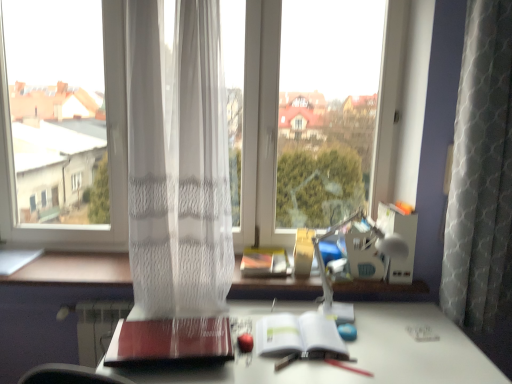
Question: Is white glossy desk at center next to white sheer curtain at center and touching it?

Choices:
 (A) no
 (B) yes

Answer: (A)

Question: Is white glossy desk at center positioned with its back to white sheer curtain at center?

Choices:
 (A) yes
 (B) no

Answer: (B)

Question: Is white glossy desk at center to the left of white sheer curtain at center from the viewer's perspective?

Choices:
 (A) yes
 (B) no

Answer: (B)

Question: Is white sheer curtain at center completely or partially inside white glossy desk at center?

Choices:
 (A) yes
 (B) no

Answer: (B)

Question: Does white glossy desk at center have a lesser width compared to white sheer curtain at center?

Choices:
 (A) yes
 (B) no

Answer: (B)

Question: In terms of size, does matte red notebook at center, the 1th paperback book viewed from the left, appear bigger or smaller than white sheer curtain at center?

Choices:
 (A) small
 (B) big

Answer: (A)

Question: Looking at their shapes, would you say matte red notebook at center, positioned as the second paperback book in right-to-left order, is wider or thinner than white sheer curtain at center?

Choices:
 (A) wide
 (B) thin

Answer: (A)

Question: Would you say matte red notebook at center, the 1th paperback book viewed from the left, is inside or outside white sheer curtain at center?

Choices:
 (A) outside
 (B) inside

Answer: (A)

Question: Considering the positions of matte red notebook at center, positioned as the second paperback book in right-to-left order, and white sheer curtain at center in the image, is matte red notebook at center, positioned as the second paperback book in right-to-left order, taller or shorter than white sheer curtain at center?

Choices:
 (A) short
 (B) tall

Answer: (A)

Question: From the image's perspective, is transparent fabric at center located above or below matte red notebook at center, positioned as the second paperback book in right-to-left order?

Choices:
 (A) above
 (B) below

Answer: (A)

Question: Choose the correct answer: Is transparent fabric at center inside matte red notebook at center, the 1th paperback book viewed from the left, or outside it?

Choices:
 (A) inside
 (B) outside

Answer: (B)

Question: Is point (121, 185) closer or farther from the camera than point (194, 357)?

Choices:
 (A) farther
 (B) closer

Answer: (A)

Question: Is transparent fabric at center to the left or to the right of matte red notebook at center, the 1th paperback book viewed from the left, in the image?

Choices:
 (A) left
 (B) right

Answer: (A)

Question: Looking at the image, does white sheer curtain at center seem bigger or smaller compared to transparent fabric at center?

Choices:
 (A) small
 (B) big

Answer: (A)

Question: From a real-world perspective, is white sheer curtain at center above or below transparent fabric at center?

Choices:
 (A) above
 (B) below

Answer: (B)